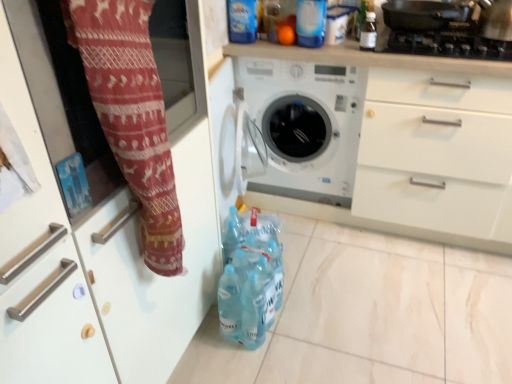
I want to click on vacant space positioned to the left of transparent plastic bottle at upper right, placed as the first bottle when sorted from right to left, so click(x=336, y=49).